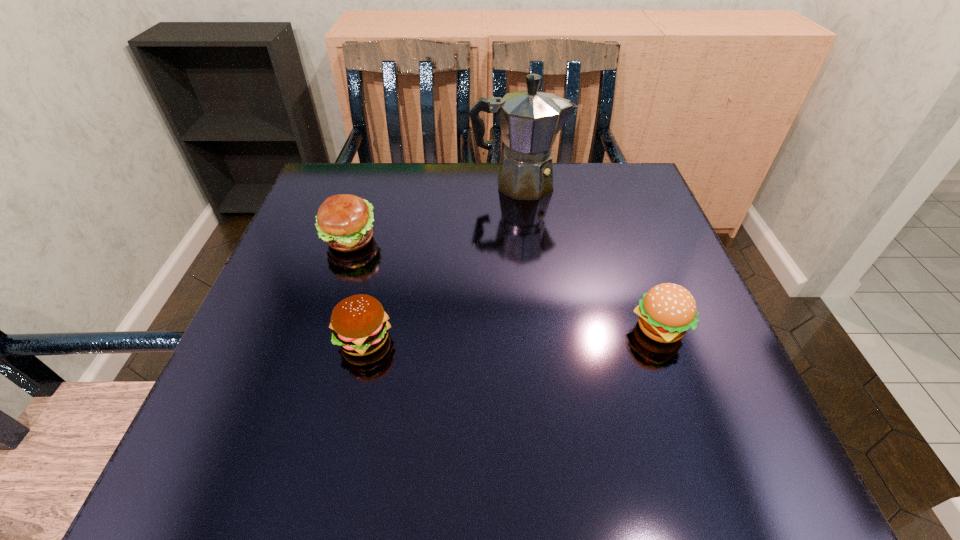
The image size is (960, 540). Identify the location of the tallest object. (530, 120).

The image size is (960, 540). I want to click on the second object from right to left, so click(x=530, y=120).

Locate an element on the screen. Image resolution: width=960 pixels, height=540 pixels. the second farthest object is located at coordinates (344, 221).

This screenshot has height=540, width=960. What are the coordinates of `the rightmost hamburger` in the screenshot? It's located at (667, 311).

At what (x,y) coordinates should I click in order to perform the action: click on vacant space located 0.140m on the pouring side of the third object from left to right. Please return your answer as a coordinate pair (x, y). Looking at the image, I should click on (622, 184).

At what (x,y) coordinates should I click in order to perform the action: click on free space located 0.140m on the right of the third nearest object. Please return your answer as a coordinate pair (x, y). The image size is (960, 540). Looking at the image, I should click on (444, 240).

Find the location of a particular element. The width and height of the screenshot is (960, 540). vacant space located on the left of the rightmost hamburger is located at coordinates (466, 329).

Where is `object that is at the far edge`? The image size is (960, 540). object that is at the far edge is located at coordinates point(530,120).

At what (x,y) coordinates should I click in order to perform the action: click on object that is at the right edge. Please return your answer as a coordinate pair (x, y). The image size is (960, 540). Looking at the image, I should click on (667, 311).

Identify the location of vacant space at the far edge of the desktop. This screenshot has height=540, width=960. (414, 180).